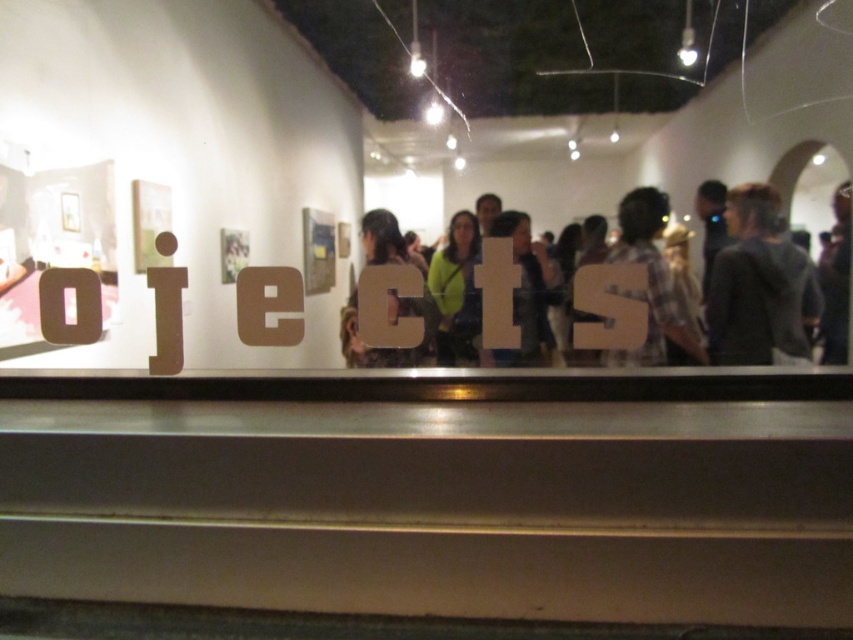
Question: Which point is closer to the camera?

Choices:
 (A) (786, 308)
 (B) (396, 323)
 (C) (683, 333)
 (D) (784, 332)

Answer: (B)

Question: Which point is closer to the camera?

Choices:
 (A) plaid shirt at center
 (B) matte brown letter c at center
 (C) green fabric shirt at center

Answer: (B)

Question: Is dark gray sweater at right positioned at the back of matte brown letter c at center?

Choices:
 (A) no
 (B) yes

Answer: (B)

Question: Which object is the farthest from the matte brown letter c at center?

Choices:
 (A) plaid shirt at center
 (B) dark gray sweater at right

Answer: (B)

Question: Where is plaid shirt at center located in relation to matte brown letter c at center in the image?

Choices:
 (A) left
 (B) right

Answer: (B)

Question: Is plaid shirt at center above matte brown letter c at center?

Choices:
 (A) yes
 (B) no

Answer: (A)